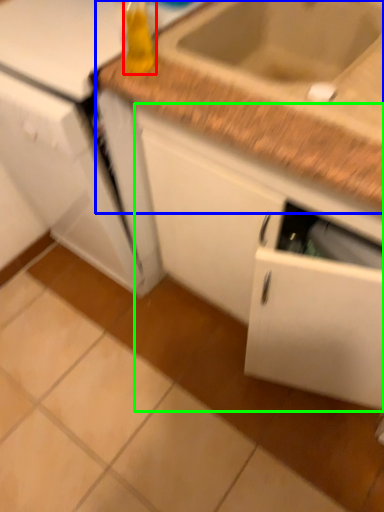
Question: Which object is positioned closest to bottle (highlighted by a red box)? Select from countertop (highlighted by a blue box) and cabinetry (highlighted by a green box).

Choices:
 (A) countertop
 (B) cabinetry

Answer: (A)